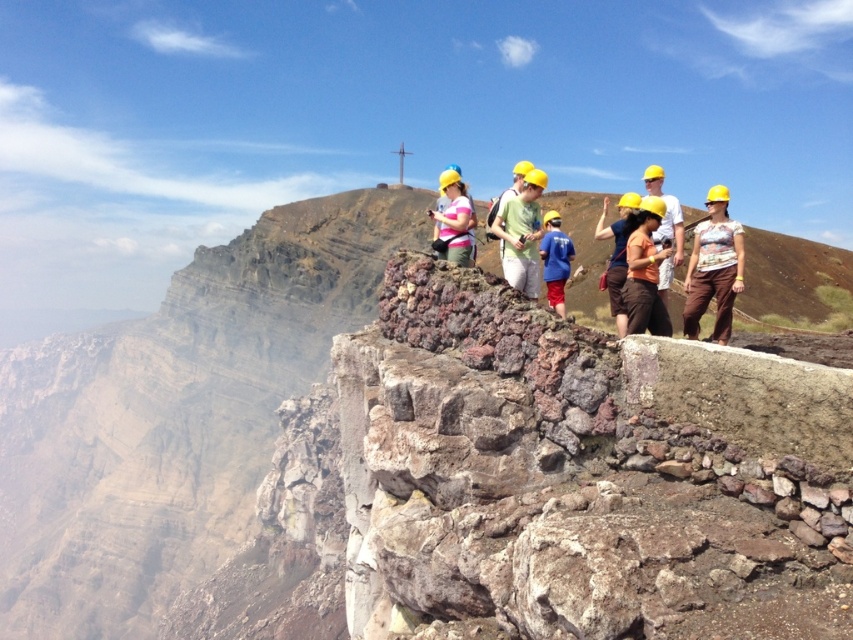
Who is more forward, (x=714, y=252) or (x=469, y=200)?

Positioned in front is point (x=714, y=252).

Is matte yellow hard hat at center behind pink fabric shirt at center?

No, matte yellow hard hat at center is in front of pink fabric shirt at center.

Does point (717, 328) come farther from viewer compared to point (462, 240)?

No, (717, 328) is in front of (462, 240).

The height and width of the screenshot is (640, 853). I want to click on matte yellow hard hat at center, so click(x=712, y=268).

Does light green fabric shirt at center appear under pink fabric shirt at center?

Yes, light green fabric shirt at center is below pink fabric shirt at center.

This screenshot has height=640, width=853. Describe the element at coordinates (521, 234) in the screenshot. I see `light green fabric shirt at center` at that location.

Does point (502, 211) come farther from viewer compared to point (454, 193)?

No, (502, 211) is in front of (454, 193).

You are a GUI agent. You are given a task and a screenshot of the screen. Output one action in this format:
    pyautogui.click(x=<x>, y=<y>)
    Task: Click on the light green fabric shirt at center
    
    Given the screenshot: What is the action you would take?
    pyautogui.click(x=521, y=234)

Which is above, light green fabric shirt at center or yellow hard hat at center?

yellow hard hat at center

Between light green fabric shirt at center and yellow hard hat at center, which one has more height?

With more height is yellow hard hat at center.

Identify the location of light green fabric shirt at center. Image resolution: width=853 pixels, height=640 pixels. (521, 234).